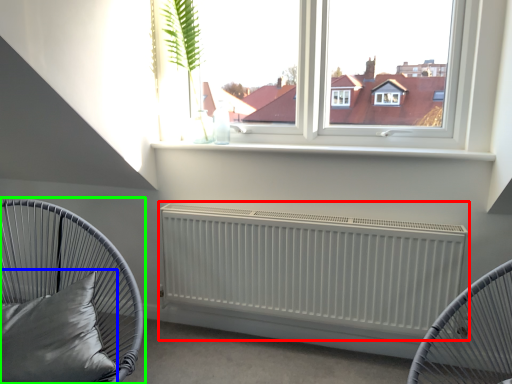
Question: Which is farther away from radiator (highlighted by a red box)? pillow (highlighted by a blue box) or furniture (highlighted by a green box)?

Choices:
 (A) pillow
 (B) furniture

Answer: (A)